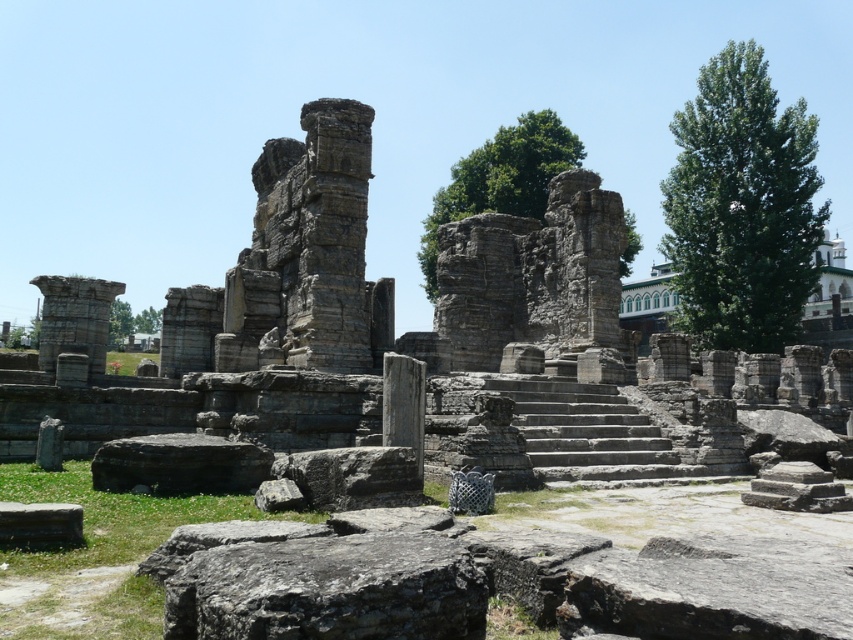
You are an archaeologist examining the ancient ruins. You notice the gray rough stone at center and the gray stone at lower left. Which stone is closer to you?

The gray rough stone at center is closer to you since it is in front of the gray stone at lower left.